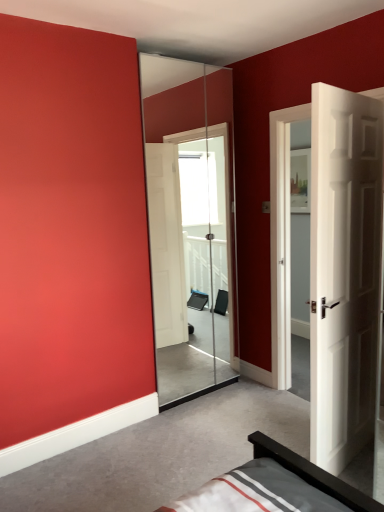
Find the location of a particular element. The image size is (384, 512). free space above transparent glass screen door at center (from a real-world perspective) is located at coordinates (200, 51).